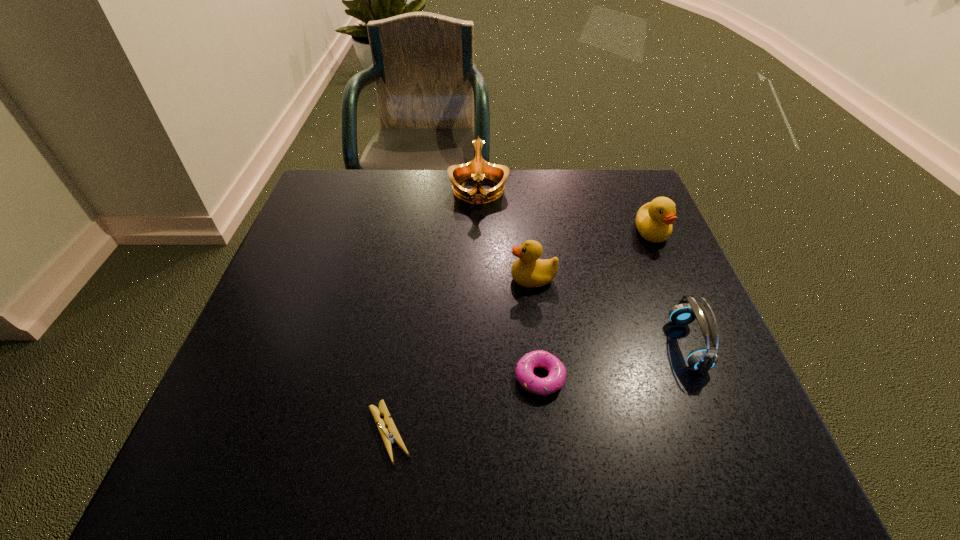
The width and height of the screenshot is (960, 540). Identify the location of object that is the second closest to the farthest object. (654, 220).

Where is `vacant space that satisfies the following two spatial constraints: 1. at the beak of the left duck; 2. on the front side of the fifth tallest object`? vacant space that satisfies the following two spatial constraints: 1. at the beak of the left duck; 2. on the front side of the fifth tallest object is located at coordinates (544, 377).

Where is `vacant area that satisfies the following two spatial constraints: 1. at the beak of the fifth nearest object; 2. on the ear cups of the headset`? vacant area that satisfies the following two spatial constraints: 1. at the beak of the fifth nearest object; 2. on the ear cups of the headset is located at coordinates (700, 345).

Where is `vacant position in the image that satisfies the following two spatial constraints: 1. at the beak of the farther duck; 2. at the beak of the fourth nearest object`? The width and height of the screenshot is (960, 540). vacant position in the image that satisfies the following two spatial constraints: 1. at the beak of the farther duck; 2. at the beak of the fourth nearest object is located at coordinates (671, 279).

The height and width of the screenshot is (540, 960). Find the location of `vacant space that satisfies the following two spatial constraints: 1. at the front emblem of the tiara; 2. on the left side of the doughnut`. vacant space that satisfies the following two spatial constraints: 1. at the front emblem of the tiara; 2. on the left side of the doughnut is located at coordinates (477, 377).

What are the coordinates of `free space that satisfies the following two spatial constraints: 1. on the back side of the doughnut; 2. on the left side of the clothespin` in the screenshot? It's located at (397, 377).

At what (x,y) coordinates should I click in order to perform the action: click on blank area in the image that satisfies the following two spatial constraints: 1. on the back side of the doughnut; 2. on the right side of the clothespin. Please return your answer as a coordinate pair (x, y). This screenshot has height=540, width=960. Looking at the image, I should click on (397, 377).

Locate an element on the screen. This screenshot has width=960, height=540. free space that satisfies the following two spatial constraints: 1. at the beak of the left duck; 2. on the front side of the fifth tallest object is located at coordinates (544, 377).